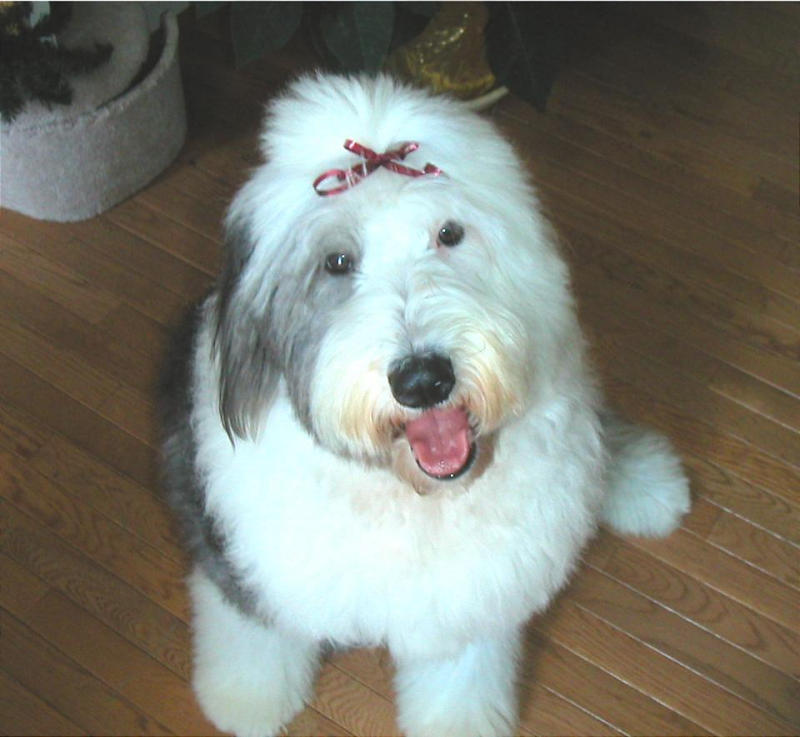
Identify the location of floor. (82, 424).